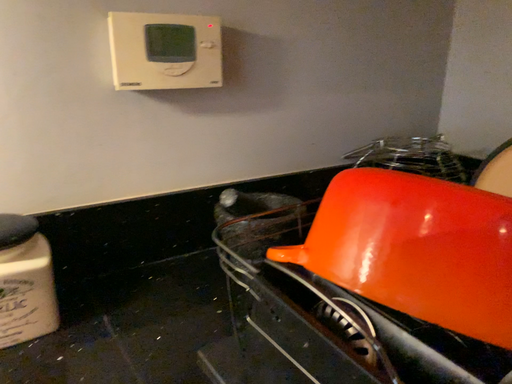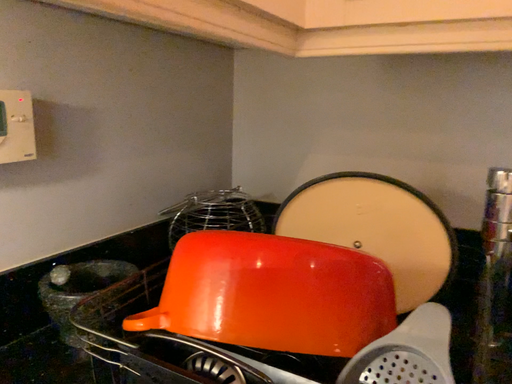
Question: Which way did the camera rotate in the video?

Choices:
 (A) rotated right
 (B) rotated left

Answer: (A)